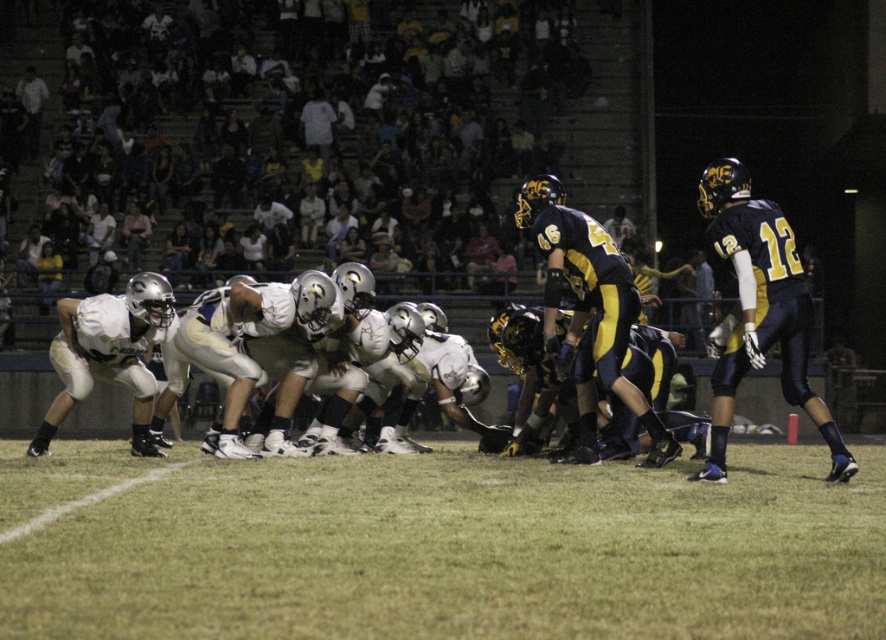
Between green grass at center and white matte uniform at center, which one has less height?

With less height is green grass at center.

Does green grass at center have a smaller size compared to white matte uniform at center?

Yes, green grass at center is smaller than white matte uniform at center.

Is point (259, 605) closer to camera compared to point (734, 257)?

Yes, it is.

Find the location of a particular element. The height and width of the screenshot is (640, 886). green grass at center is located at coordinates (437, 547).